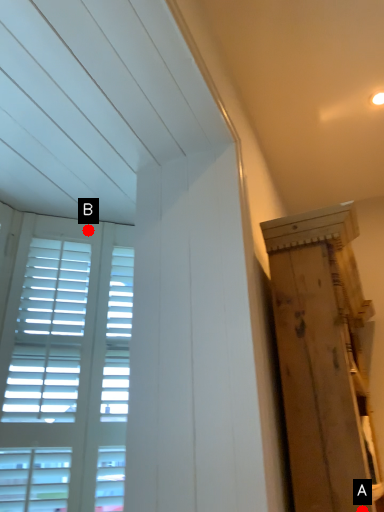
Question: Two points are circled on the image, labeled by A and B beside each circle. Which of the following is the closest to the observer?

Choices:
 (A) A is closer
 (B) B is closer

Answer: (A)